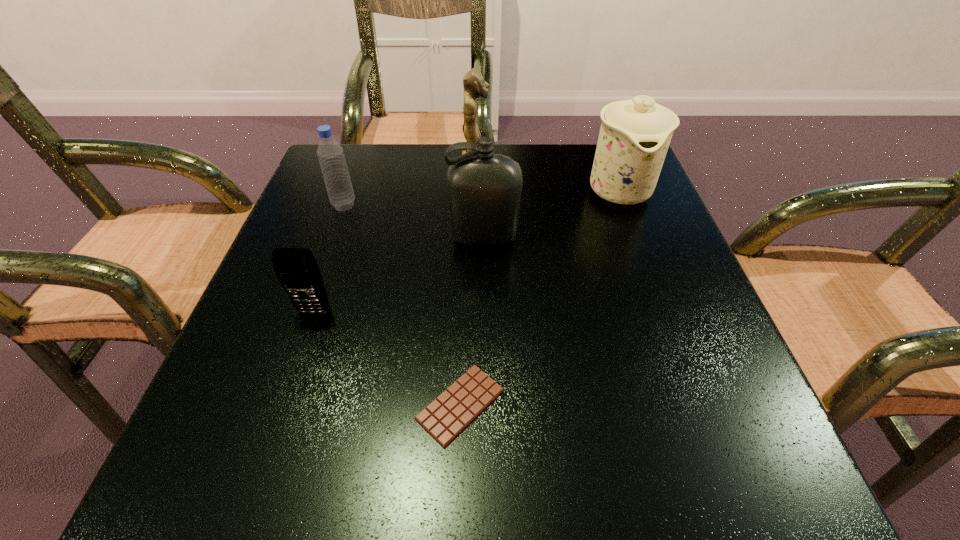
Locate an element on the screen. The width and height of the screenshot is (960, 540). vacant area between the third nearest object and the shorter bottle is located at coordinates (414, 221).

You are a GUI agent. You are given a task and a screenshot of the screen. Output one action in this format:
    pyautogui.click(x=<x>, y=<y>)
    Task: Click on the object that can be found as the second closest to the rightmost object
    The height and width of the screenshot is (540, 960).
    Given the screenshot: What is the action you would take?
    [474, 85]

Identify which object is located as the third nearest to the third nearest object. Please provide its 2D coordinates. Your answer should be formatted as a tuple, i.e. [(x, y)], where the tuple contains the x and y coordinates of a point satisfying the conditions above.

[(331, 157)]

Identify the location of blank space that satisfies the following two spatial constraints: 1. on the screen of the nearest object; 2. on the left side of the second nearest object. The width and height of the screenshot is (960, 540). tap(283, 404).

The image size is (960, 540). Identify the location of free space that satisfies the following two spatial constraints: 1. on the screen of the second nearest object; 2. on the left side of the candy bar. (283, 404).